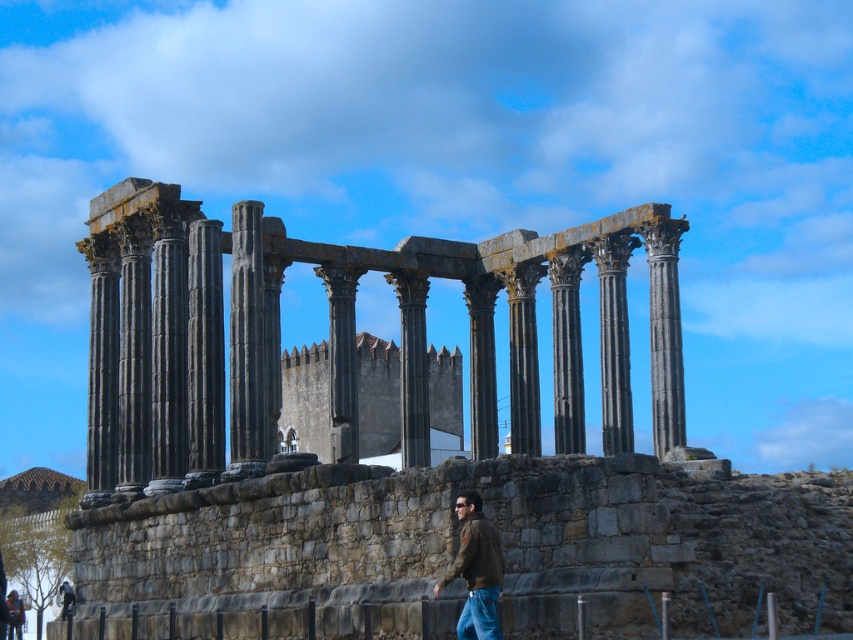
Question: Does dark gray stone columns at center appear on the right side of dark gray stone column at center?

Choices:
 (A) yes
 (B) no

Answer: (A)

Question: Does dark gray stone column at center lie behind black stone column at center?

Choices:
 (A) no
 (B) yes

Answer: (A)

Question: Among these points, which one is nearest to the camera?

Choices:
 (A) (251, 422)
 (B) (339, 284)

Answer: (A)

Question: Which object is positioned farthest from the dark gray stone columns at center?

Choices:
 (A) black stone column at center
 (B) brown leather jacket at lower right
 (C) dark gray stone column at center

Answer: (B)

Question: Which object is closer to the camera taking this photo?

Choices:
 (A) dark gray stone columns at center
 (B) dark gray stone column at center
 (C) black stone column at center
 (D) brown leather jacket at lower right

Answer: (D)

Question: Is dark gray stone columns at center positioned in front of brown leather jacket at lower right?

Choices:
 (A) no
 (B) yes

Answer: (A)